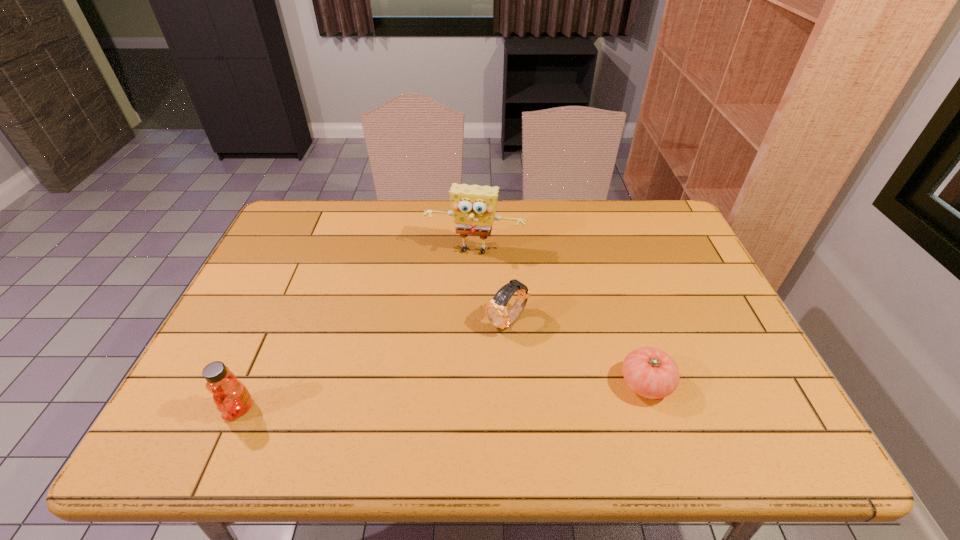
In the image, there is a desktop. Identify the location of vacant space at the far edge. The width and height of the screenshot is (960, 540). (519, 217).

Identify the location of free space at the near edge. (471, 385).

In order to click on free region at the left edge of the desktop in this screenshot , I will do `click(252, 367)`.

Identify the location of vacant area at the right edge. (719, 315).

In the image, there is a desktop. At what (x,y) coordinates should I click in order to perform the action: click on vacant space at the far right corner. Please return your answer as a coordinate pair (x, y). The height and width of the screenshot is (540, 960). Looking at the image, I should click on (637, 199).

Locate an element on the screen. The image size is (960, 540). empty space that is in between the second farthest object and the tomato is located at coordinates (576, 353).

At what (x,y) coordinates should I click in order to perform the action: click on free space between the sponge and the second farthest object. Please return your answer as a coordinate pair (x, y). Looking at the image, I should click on (491, 287).

Locate an element on the screen. This screenshot has height=540, width=960. empty space between the watch and the sponge is located at coordinates (491, 287).

At what (x,y) coordinates should I click in order to perform the action: click on blank region between the tallest object and the third tallest object. Please return your answer as a coordinate pair (x, y). Looking at the image, I should click on (491, 287).

This screenshot has height=540, width=960. In order to click on vacant space that's between the tomato and the watch in this screenshot , I will do `click(576, 353)`.